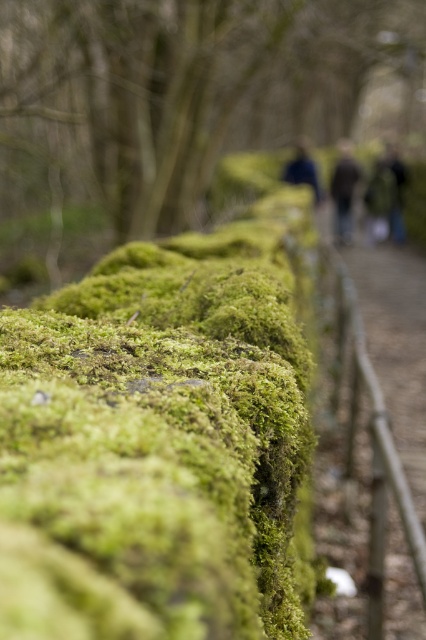
Is point (339, 148) more distant than point (290, 172)?

Yes, point (339, 148) is farther from viewer.

Is point (350, 150) less distant than point (284, 177)?

That is False.

Where is `dark brown leather jacket at upper center`? The height and width of the screenshot is (640, 426). dark brown leather jacket at upper center is located at coordinates (344, 189).

In the scene shown: Between green mossy wall at center and wooden fence at upper right, which one appears on the right side from the viewer's perspective?

wooden fence at upper right

Find the location of a particular element. The height and width of the screenshot is (640, 426). green mossy wall at center is located at coordinates (163, 440).

Does point (129, 252) come farther from viewer compared to point (316, 524)?

No, (129, 252) is closer to viewer.

The image size is (426, 640). I want to click on green mossy wall at center, so click(163, 440).

Between wooden fence at upper right and dark brown leather jacket at upper center, which one is positioned lower?

wooden fence at upper right

At what (x,y) coordinates should I click in order to perform the action: click on wooden fence at upper right. Please return your answer as a coordinate pair (x, y). The image size is (426, 640). Looking at the image, I should click on (396, 346).

The image size is (426, 640). Find the location of `wooden fence at upper right`. wooden fence at upper right is located at coordinates (396, 346).